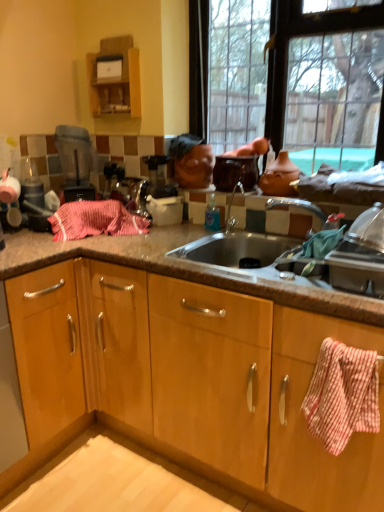
Question: Is matte glass window at upper center positioned in front of pink woven towel at center?

Choices:
 (A) no
 (B) yes

Answer: (B)

Question: Can you confirm if matte glass window at upper center is bigger than pink woven towel at center?

Choices:
 (A) no
 (B) yes

Answer: (B)

Question: Is matte glass window at upper center positioned beyond the bounds of pink woven towel at center?

Choices:
 (A) yes
 (B) no

Answer: (A)

Question: Considering the relative positions of matte glass window at upper center and pink woven towel at center in the image provided, is matte glass window at upper center to the right of pink woven towel at center from the viewer's perspective?

Choices:
 (A) yes
 (B) no

Answer: (A)

Question: Can you confirm if matte glass window at upper center is positioned to the left of pink woven towel at center?

Choices:
 (A) yes
 (B) no

Answer: (B)

Question: Does matte glass window at upper center lie behind pink woven towel at center?

Choices:
 (A) yes
 (B) no

Answer: (B)

Question: From the image's perspective, is wooden cabinet at upper left, the 2th cabinetry in the right-to-left sequence, under matte glass window at upper center?

Choices:
 (A) yes
 (B) no

Answer: (B)

Question: From the image's perspective, would you say wooden cabinet at upper left, which ranks as the first cabinetry in top-to-bottom order, is positioned over matte glass window at upper center?

Choices:
 (A) no
 (B) yes

Answer: (B)

Question: Is matte glass window at upper center inside wooden cabinet at upper left, acting as the 1th cabinetry starting from the left?

Choices:
 (A) no
 (B) yes

Answer: (A)

Question: Is wooden cabinet at upper left, the 2th cabinetry in the right-to-left sequence, positioned in front of matte glass window at upper center?

Choices:
 (A) no
 (B) yes

Answer: (A)

Question: Does wooden cabinet at upper left, acting as the first cabinetry starting from the back, have a smaller size compared to matte glass window at upper center?

Choices:
 (A) yes
 (B) no

Answer: (A)

Question: Can you confirm if wooden cabinet at upper left, acting as the first cabinetry starting from the back, is wider than matte glass window at upper center?

Choices:
 (A) no
 (B) yes

Answer: (A)

Question: Is wooden cabinet at upper left, acting as the first cabinetry starting from the back, positioned far away from glossy ceramic pot at upper center, which is counted as the 2th appliance, starting from the left?

Choices:
 (A) no
 (B) yes

Answer: (A)